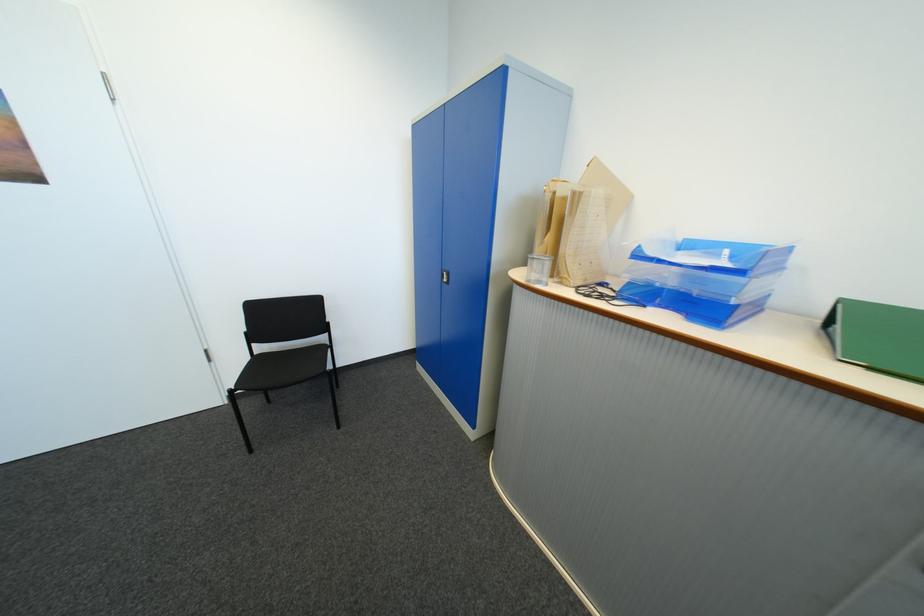
The width and height of the screenshot is (924, 616). Describe the element at coordinates (538, 269) in the screenshot. I see `a mesh pen holder` at that location.